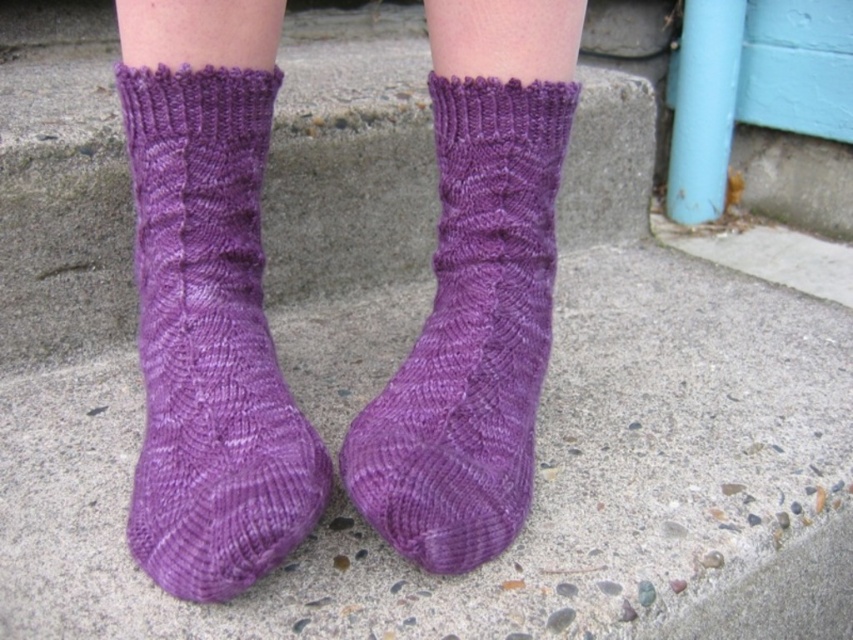
Between purple knitted sock at left and purple knitted sock at center, which one has less height?

purple knitted sock at center

Does purple knitted sock at left have a lesser width compared to purple knitted sock at center?

Incorrect, purple knitted sock at left's width is not less than purple knitted sock at center's.

The image size is (853, 640). What are the coordinates of `purple knitted sock at left` in the screenshot? It's located at (209, 340).

Locate an element on the screen. This screenshot has height=640, width=853. purple knitted sock at left is located at coordinates (209, 340).